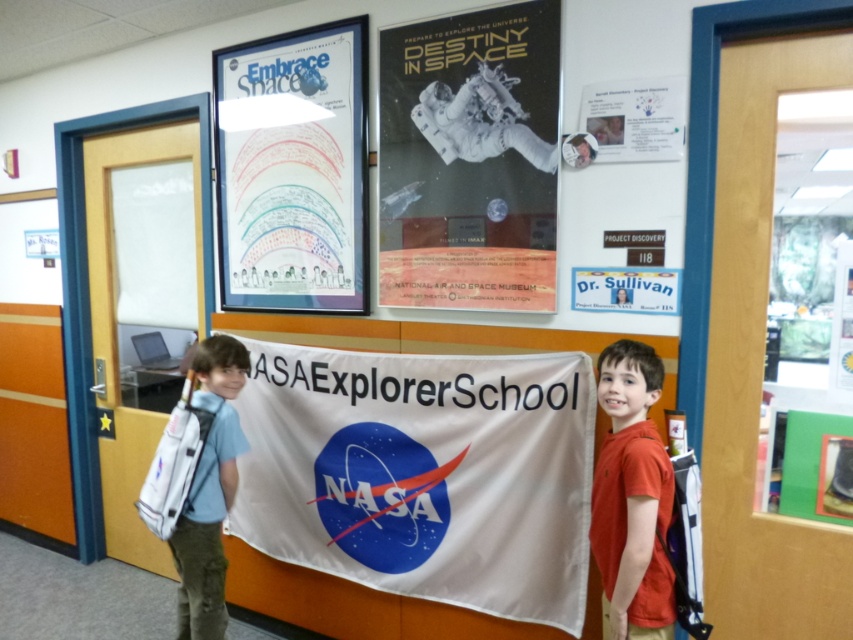
You are a photographer setting up for a group photo in the room. You need to ensure that the orange matte shirt at right and the white paper at upper right are both visible in the frame. Based on their positions, which object should you adjust your camera angle to focus on first to include both in the shot?

The orange matte shirt at right is located below the white paper at upper right. To include both in the frame, focus on the white paper at upper right first, then adjust the camera angle downward to ensure the orange matte shirt at right is also visible.

You are standing in front of the NASA Explorer School banner and see the matte black poster at upper center. Can you determine its exact location on the wall using coordinates?

The matte black poster at upper center is located at coordinates point (469, 160).

You are a robot with a 1.20 meter arm reach. You need to grab both the colored paper rainbow at upper left and the orange matte shirt at right. Can you reach both objects without moving your position?

The distance between the colored paper rainbow at upper left and the orange matte shirt at right is 1.30 meters. Since your arm reach is 1.20 meters, you cannot reach both objects simultaneously without moving your position.